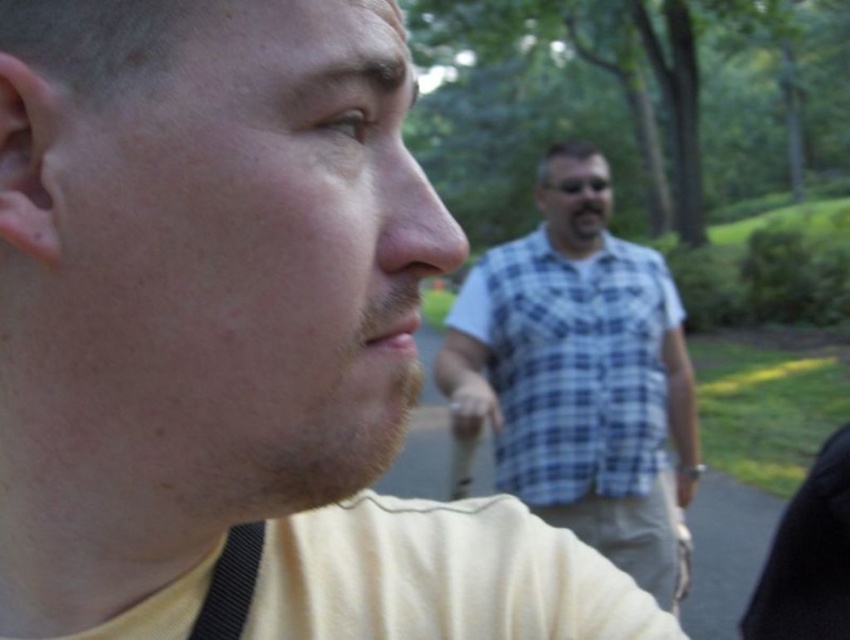
Where is `blue plaid shirt at center`? blue plaid shirt at center is located at coordinates [x=581, y=376].

Which is behind, point (547, 163) or point (231, 573)?

Point (547, 163)

This screenshot has height=640, width=850. Identify the location of blue plaid shirt at center. (581, 376).

You are a GUI agent. You are given a task and a screenshot of the screen. Output one action in this format:
    pyautogui.click(x=<x>, y=<y>)
    Task: Click on the blue plaid shirt at center
    The height and width of the screenshot is (640, 850).
    Given the screenshot: What is the action you would take?
    pyautogui.click(x=581, y=376)